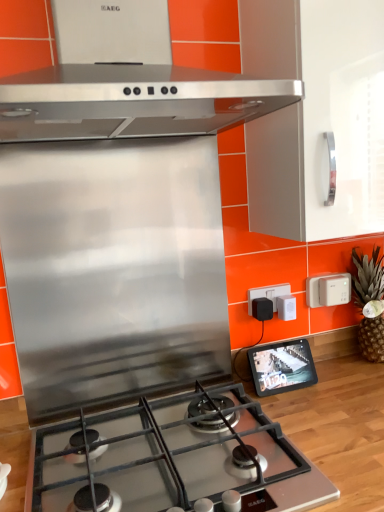
Question: In terms of size, does stainless steel gas stove at center appear bigger or smaller than black plastic at upper right, placed as the first electric outlet when sorted from left to right?

Choices:
 (A) big
 (B) small

Answer: (A)

Question: Considering the positions of point (36, 486) and point (258, 289), is point (36, 486) closer or farther from the camera than point (258, 289)?

Choices:
 (A) closer
 (B) farther

Answer: (A)

Question: Which object is positioned closest to the stainless steel gas stove at center?

Choices:
 (A) black glossy tablet at right
 (B) white plastic electric outlet at upper right, the 1th electric outlet positioned from the right
 (C) green textured pineapple at right
 (D) black plastic at upper right, placed as the first electric outlet when sorted from left to right
 (E) stainless steel range hood at upper center

Answer: (A)

Question: Which object is the farthest from the black plastic at upper right, placed as the first electric outlet when sorted from left to right?

Choices:
 (A) black glossy tablet at right
 (B) white plastic electric outlet at upper right, the second electric outlet when ordered from left to right
 (C) stainless steel range hood at upper center
 (D) green textured pineapple at right
 (E) stainless steel gas stove at center

Answer: (C)